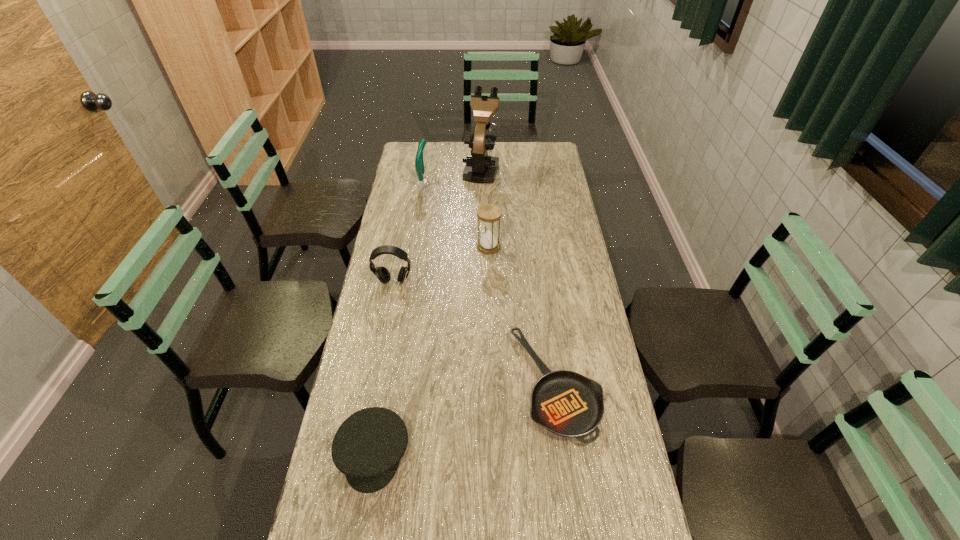
Where is `vacant space located 0.230m on the ear cups of the earphone`? vacant space located 0.230m on the ear cups of the earphone is located at coordinates (383, 339).

This screenshot has width=960, height=540. I want to click on vacant area located on the left of the shortest object, so click(x=432, y=385).

Where is `object positioned at the far edge`? object positioned at the far edge is located at coordinates (481, 168).

Find the location of a particular element. The image size is (960, 540). bottle opener that is at the left edge is located at coordinates (419, 163).

This screenshot has width=960, height=540. I want to click on earphone at the left edge, so click(383, 275).

The image size is (960, 540). In order to click on beret positioned at the left edge in this screenshot , I will do (367, 447).

Locate an element on the screen. object at the right edge is located at coordinates (568, 404).

The image size is (960, 540). Find the location of `free space at the far edge`. free space at the far edge is located at coordinates (504, 165).

In the image, there is a desktop. Where is `free space at the left edge`? The width and height of the screenshot is (960, 540). free space at the left edge is located at coordinates (368, 376).

Where is `free spot at the right edge of the desktop`? free spot at the right edge of the desktop is located at coordinates (554, 199).